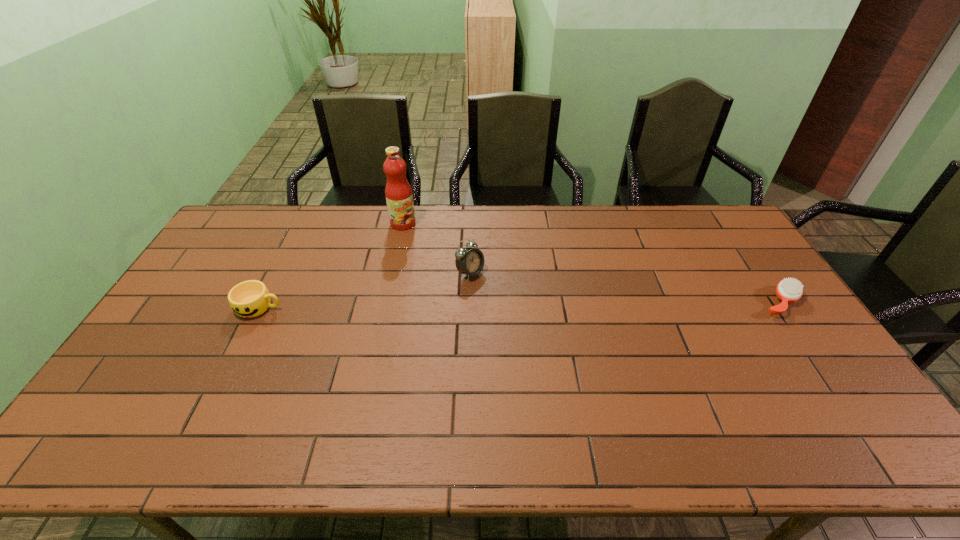
Identify the location of free spot between the farthest object and the leftmost object. (331, 265).

The image size is (960, 540). In order to click on free area in between the third object from left to right and the leftmost object in this screenshot , I will do `click(365, 290)`.

Where is `object identified as the closest to the hairbrush`? The height and width of the screenshot is (540, 960). object identified as the closest to the hairbrush is located at coordinates (470, 261).

Find the location of a particular element. The width and height of the screenshot is (960, 540). object that is the second closest to the cup is located at coordinates (470, 261).

The height and width of the screenshot is (540, 960). I want to click on vacant space that satisfies the following two spatial constraints: 1. on the front side of the second object from left to right; 2. on the left side of the hairbrush, so click(x=386, y=302).

Identify the location of vacant space that satisfies the following two spatial constraints: 1. on the back side of the rightmost object; 2. on the right side of the cup. This screenshot has width=960, height=540. (262, 302).

The image size is (960, 540). I want to click on free space that satisfies the following two spatial constraints: 1. on the front side of the fruit juice; 2. on the left side of the alarm clock, so click(393, 273).

You are a GUI agent. You are given a task and a screenshot of the screen. Output one action in this format:
    pyautogui.click(x=<x>, y=<y>)
    Task: Click on the vacant space that satisfies the following two spatial constraints: 1. on the back side of the cup; 2. on the left side of the rightmost object
    The width and height of the screenshot is (960, 540).
    Given the screenshot: What is the action you would take?
    pyautogui.click(x=262, y=302)